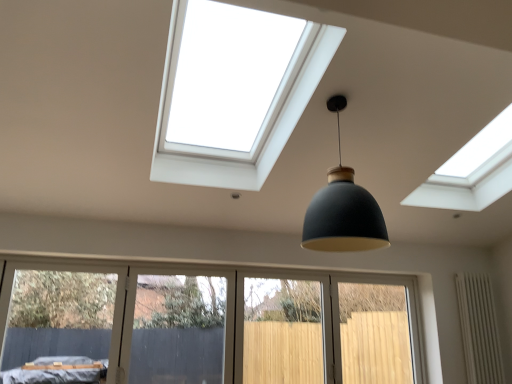
Question: Could you tell me if white textured radiator at lower right is facing matte black pendant light at center?

Choices:
 (A) yes
 (B) no

Answer: (B)

Question: Is matte black pendant light at center at the back of white textured radiator at lower right?

Choices:
 (A) no
 (B) yes

Answer: (A)

Question: Is white textured radiator at lower right shorter than matte black pendant light at center?

Choices:
 (A) no
 (B) yes

Answer: (A)

Question: Does white textured radiator at lower right lie in front of matte black pendant light at center?

Choices:
 (A) no
 (B) yes

Answer: (A)

Question: From the image's perspective, is white textured radiator at lower right above matte black pendant light at center?

Choices:
 (A) no
 (B) yes

Answer: (A)

Question: From a real-world perspective, is matte black pendant light at center above or below white textured radiator at lower right?

Choices:
 (A) below
 (B) above

Answer: (B)

Question: Does point (331, 248) appear closer or farther from the camera than point (476, 362)?

Choices:
 (A) farther
 (B) closer

Answer: (B)

Question: From their relative heights in the image, would you say matte black pendant light at center is taller or shorter than white textured radiator at lower right?

Choices:
 (A) short
 (B) tall

Answer: (A)

Question: Is matte black pendant light at center bigger or smaller than white textured radiator at lower right?

Choices:
 (A) big
 (B) small

Answer: (A)

Question: Based on their positions, is matte black pendant light at center located to the left or right of light wood screen door at lower center, which appears as the 2th screen door when viewed from the left?

Choices:
 (A) left
 (B) right

Answer: (A)

Question: From the image's perspective, is matte black pendant light at center located above or below light wood screen door at lower center, which is the 1th screen door in right-to-left order?

Choices:
 (A) below
 (B) above

Answer: (B)

Question: Is matte black pendant light at center bigger or smaller than light wood screen door at lower center, which is the 1th screen door in right-to-left order?

Choices:
 (A) big
 (B) small

Answer: (A)

Question: Considering the positions of matte black pendant light at center and light wood screen door at lower center, which appears as the 2th screen door when viewed from the left, in the image, is matte black pendant light at center wider or thinner than light wood screen door at lower center, which appears as the 2th screen door when viewed from the left,?

Choices:
 (A) thin
 (B) wide

Answer: (B)

Question: In terms of width, does white textured radiator at lower right look wider or thinner when compared to light wood screen door at lower center, which is the 1th screen door in right-to-left order?

Choices:
 (A) thin
 (B) wide

Answer: (B)

Question: From a real-world perspective, is white textured radiator at lower right above or below light wood screen door at lower center, which is the 1th screen door in right-to-left order?

Choices:
 (A) above
 (B) below

Answer: (A)